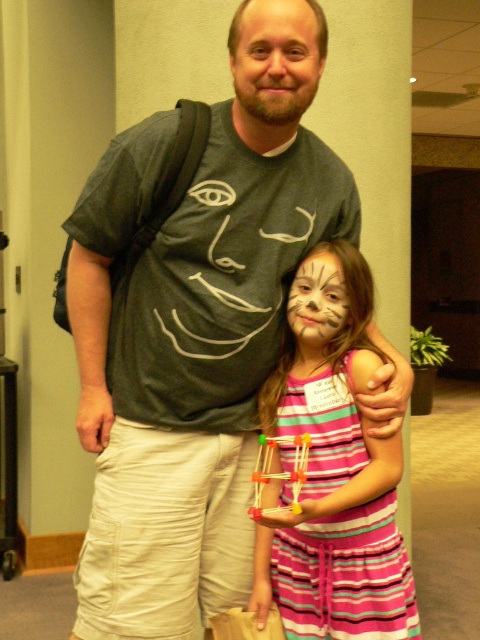
Locate an element on the screen. matte gray t-shirt at center is located at coordinates (186, 358).

Does matte gray t-shirt at center lie behind striped cotton dress at center?

That is True.

The width and height of the screenshot is (480, 640). Find the location of `matte gray t-shirt at center`. matte gray t-shirt at center is located at coordinates (186, 358).

Can you confirm if matte gray t-shirt at center is taller than white matte face paint at center?

Yes, matte gray t-shirt at center is taller than white matte face paint at center.

Between matte gray t-shirt at center and white matte face paint at center, which one is positioned higher?

white matte face paint at center

Between point (135, 397) and point (322, 317), which one is positioned behind?

Positioned behind is point (135, 397).

Find the location of a particular element. The image size is (480, 640). matte gray t-shirt at center is located at coordinates (186, 358).

Does matte gray t-shirt at center have a larger size compared to matte gray face at center?

Correct, matte gray t-shirt at center is larger in size than matte gray face at center.

Who is positioned more to the left, matte gray t-shirt at center or matte gray face at center?

matte gray t-shirt at center

Is point (87, 298) positioned in front of point (300, 99)?

No, (87, 298) is behind (300, 99).

Where is `matte gray t-shirt at center`? The image size is (480, 640). matte gray t-shirt at center is located at coordinates (186, 358).